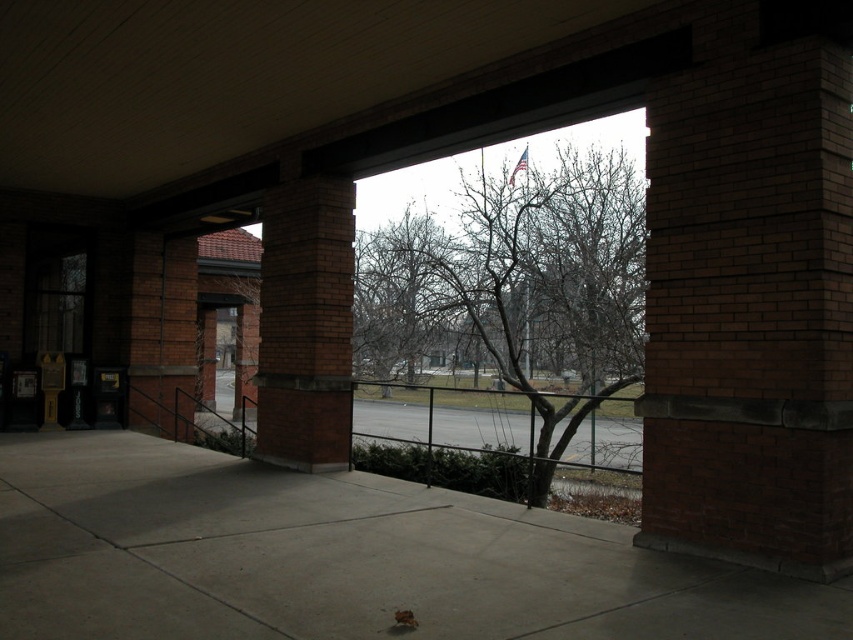
You are standing at the covered walkway and want to place a small potted plant exactly at the center of the concrete at center. According to the coordinates given, where should you place the plant?

The concrete at center is located at coordinates point (340, 557), so place the plant at that exact point.